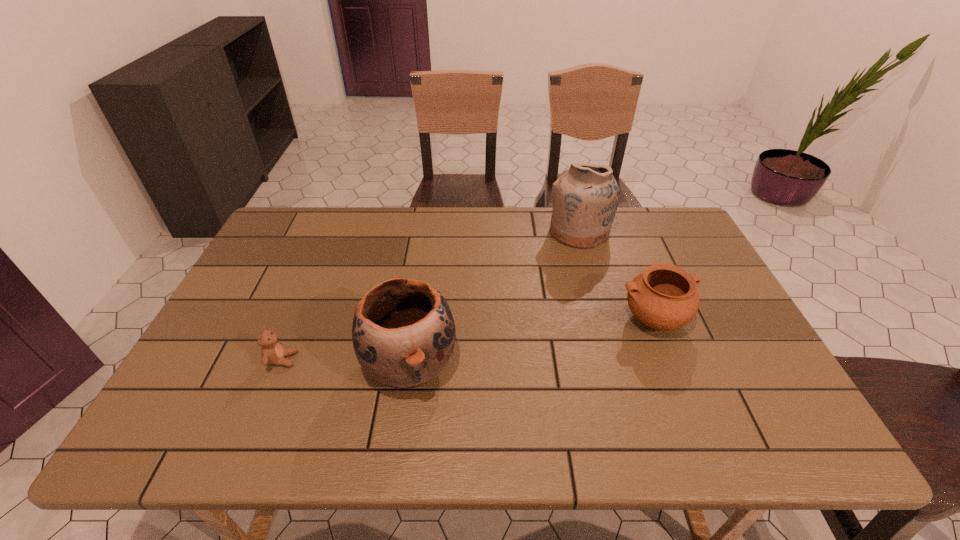
The width and height of the screenshot is (960, 540). In order to click on free space between the second tallest pottery and the farthest pottery in this screenshot , I will do `click(494, 298)`.

In order to click on free space between the shortest pottery and the leftmost object in this screenshot , I will do `click(468, 340)`.

This screenshot has height=540, width=960. What are the coordinates of `vacant area that lies between the shortest pottery and the second tallest pottery` in the screenshot? It's located at (532, 341).

Locate an element on the screen. free space between the third shortest object and the leftmost object is located at coordinates (346, 361).

You are a GUI agent. You are given a task and a screenshot of the screen. Output one action in this format:
    pyautogui.click(x=<x>, y=<y>)
    Task: Click on the free point between the tallest object and the second shortest object
    
    Given the screenshot: What is the action you would take?
    point(616,275)

Find the location of a particular element. This screenshot has width=960, height=540. free space between the second tallest pottery and the second shortest object is located at coordinates (532, 341).

Locate an element on the screen. free space between the second shortest object and the teddy bear is located at coordinates (468, 340).

Locate an element on the screen. Image resolution: width=960 pixels, height=540 pixels. free space that is in between the shortest pottery and the farthest pottery is located at coordinates (616, 275).

Identify the location of object that is the third closest one to the shortest pottery. (272, 352).

Locate an element on the screen. This screenshot has height=540, width=960. object that is the second nearest to the farthest object is located at coordinates pyautogui.click(x=403, y=333).